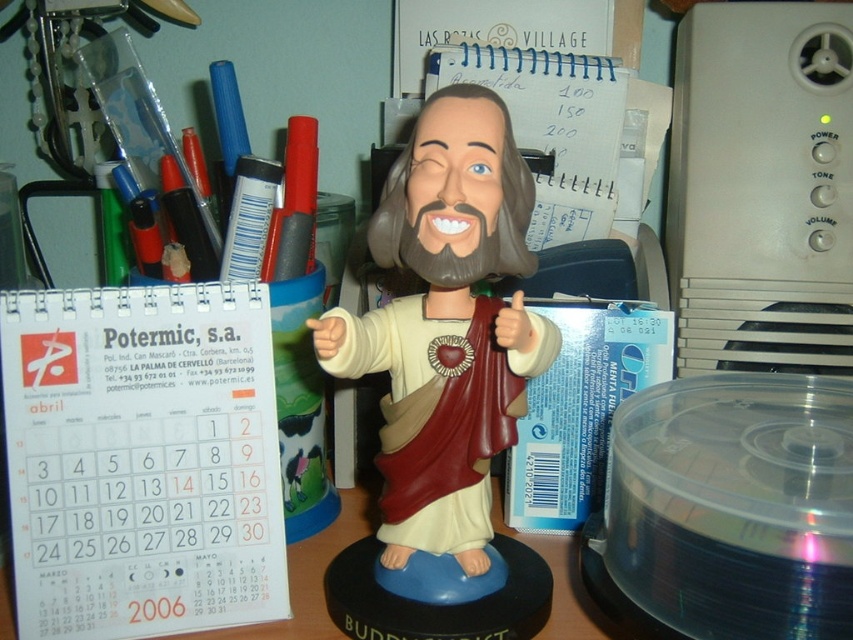
Question: Among these points, which one is nearest to the camera?

Choices:
 (A) (73, 433)
 (B) (341, 355)

Answer: (B)

Question: Which is farther from the white paper calendar at center?

Choices:
 (A) white paper calendar at left
 (B) matte plastic bobblehead at center

Answer: (A)

Question: Considering the real-world distances, which object is closest to the white paper calendar at center?

Choices:
 (A) white paper calendar at left
 (B) matte plastic bobblehead at center

Answer: (B)

Question: Is white paper calendar at left thinner than white paper calendar at center?

Choices:
 (A) no
 (B) yes

Answer: (B)

Question: Does matte plastic bobblehead at center have a lesser width compared to white paper calendar at center?

Choices:
 (A) yes
 (B) no

Answer: (A)

Question: Does white paper calendar at left have a larger size compared to white paper calendar at center?

Choices:
 (A) no
 (B) yes

Answer: (A)